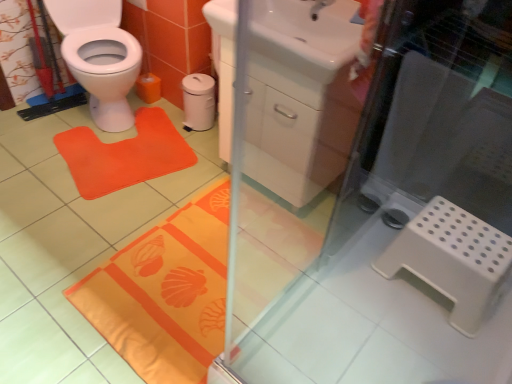
Question: Does orange fabric bath mat at lower center turn towards matte white tap at upper center?

Choices:
 (A) yes
 (B) no

Answer: (B)

Question: Does orange fabric bath mat at lower center appear on the left side of matte white tap at upper center?

Choices:
 (A) no
 (B) yes

Answer: (B)

Question: Is orange fabric bath mat at lower center wider than matte white tap at upper center?

Choices:
 (A) no
 (B) yes

Answer: (B)

Question: Considering the relative sizes of orange fabric bath mat at lower center and matte white tap at upper center in the image provided, is orange fabric bath mat at lower center shorter than matte white tap at upper center?

Choices:
 (A) yes
 (B) no

Answer: (A)

Question: Is orange fabric bath mat at lower center with matte white tap at upper center?

Choices:
 (A) yes
 (B) no

Answer: (B)

Question: Is orange fabric bath mat at lower center far from matte white tap at upper center?

Choices:
 (A) yes
 (B) no

Answer: (A)

Question: Can you confirm if white plastic step stool at lower right is thinner than orange fabric bath mat at lower center?

Choices:
 (A) yes
 (B) no

Answer: (A)

Question: From a real-world perspective, is white plastic step stool at lower right positioned under orange fabric bath mat at lower center based on gravity?

Choices:
 (A) yes
 (B) no

Answer: (B)

Question: Does white plastic step stool at lower right have a smaller size compared to orange fabric bath mat at lower center?

Choices:
 (A) yes
 (B) no

Answer: (B)

Question: Does white plastic step stool at lower right turn towards orange fabric bath mat at lower center?

Choices:
 (A) yes
 (B) no

Answer: (B)

Question: Is white plastic step stool at lower right oriented away from orange fabric bath mat at lower center?

Choices:
 (A) yes
 (B) no

Answer: (B)

Question: Considering the relative positions of white plastic step stool at lower right and orange fabric bath mat at lower center in the image provided, is white plastic step stool at lower right in front of orange fabric bath mat at lower center?

Choices:
 (A) no
 (B) yes

Answer: (B)

Question: Does matte white tap at upper center appear on the left side of white plastic step stool at lower right?

Choices:
 (A) no
 (B) yes

Answer: (B)